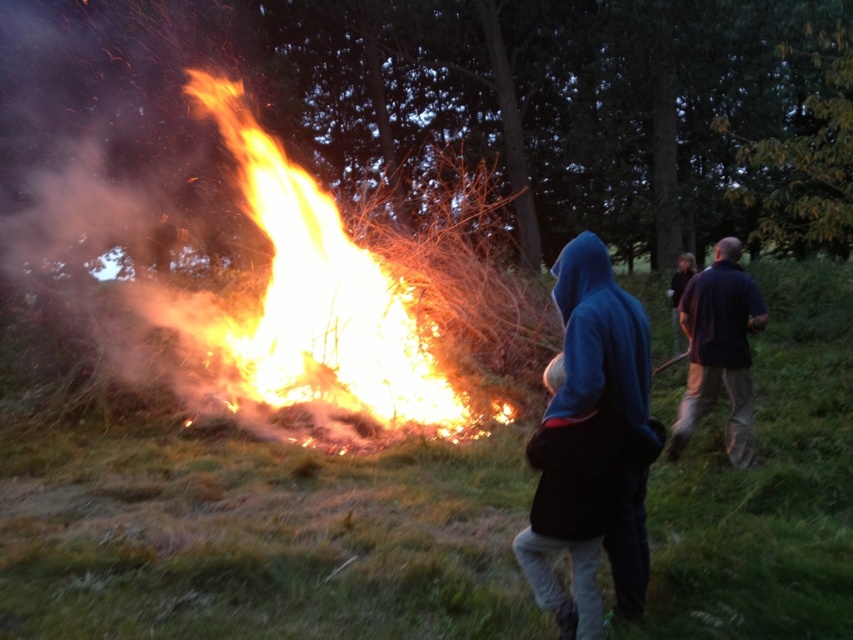
This screenshot has width=853, height=640. I want to click on flaming wood at center, so click(325, 296).

This screenshot has height=640, width=853. Find the location of `flaming wood at center`. flaming wood at center is located at coordinates (325, 296).

Which is in front, point (379, 298) or point (593, 289)?

Point (593, 289) is more forward.

Identify the location of flaming wood at center. (325, 296).

Is flaming wood at center thinner than dark blue hoodie at center?

Incorrect, flaming wood at center's width is not less than dark blue hoodie at center's.

Consider the image. Is flaming wood at center taller than dark blue hoodie at center?

Yes, flaming wood at center is taller than dark blue hoodie at center.

Between point (283, 401) and point (532, 465), which one is positioned behind?

Point (283, 401)

Where is `flaming wood at center`? flaming wood at center is located at coordinates (325, 296).